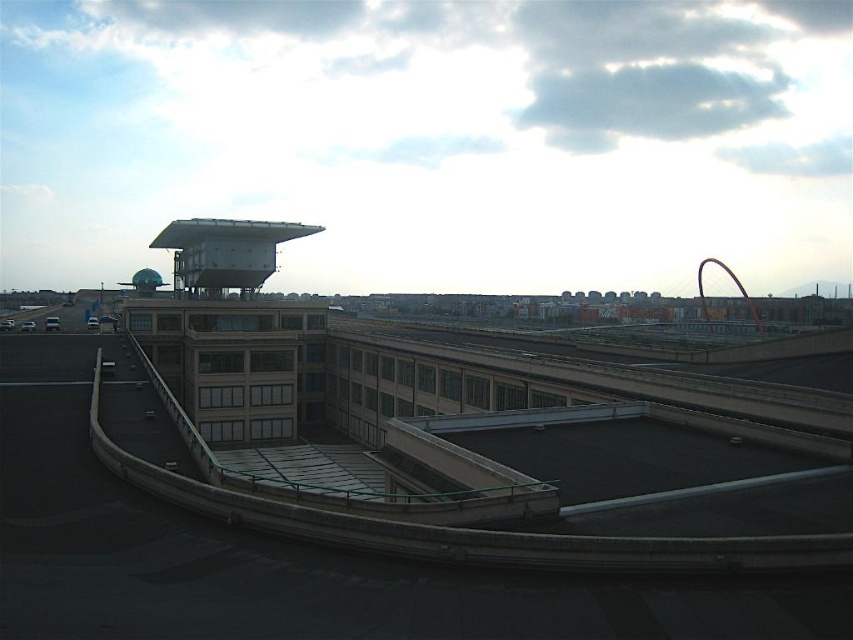
Question: Among these objects, which one is nearest to the camera?

Choices:
 (A) metallic green water tower at upper left
 (B) metallic gray water tower at upper center

Answer: (B)

Question: Is metallic gray water tower at upper center bigger than metallic green water tower at upper left?

Choices:
 (A) yes
 (B) no

Answer: (B)

Question: Can you confirm if metallic gray water tower at upper center is bigger than metallic green water tower at upper left?

Choices:
 (A) yes
 (B) no

Answer: (B)

Question: Among these objects, which one is farthest from the camera?

Choices:
 (A) metallic gray water tower at upper center
 (B) metallic green water tower at upper left

Answer: (B)

Question: Which point is farther from the camera taking this photo?

Choices:
 (A) (178, 250)
 (B) (143, 289)

Answer: (B)

Question: Can you confirm if metallic gray water tower at upper center is positioned above metallic green water tower at upper left?

Choices:
 (A) yes
 (B) no

Answer: (B)